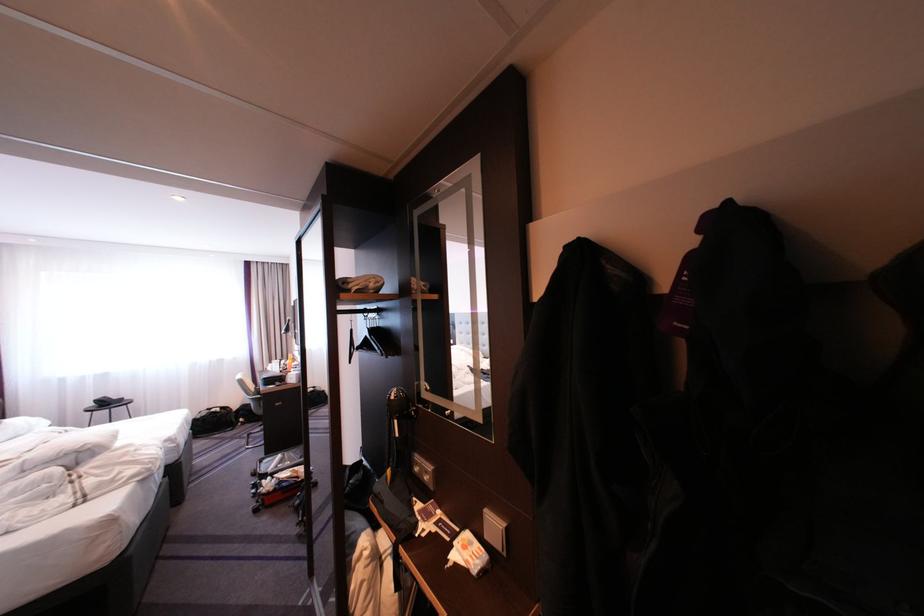
The image size is (924, 616). In order to click on white chair armrest in this screenshot , I will do pos(254,400).